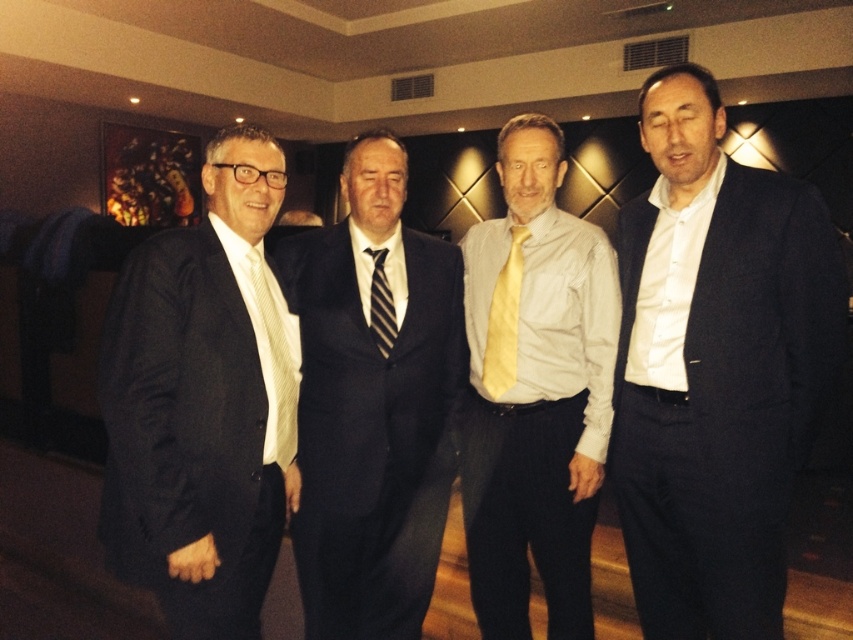
Between point (206, 461) and point (281, 321), which one is positioned in front?

Point (206, 461) is more forward.

Identify the location of matte black suit at left. (202, 403).

Who is more forward, (x=215, y=413) or (x=279, y=397)?

Point (x=215, y=413)

Where is `matte black suit at left`? matte black suit at left is located at coordinates (202, 403).

Does point (708, 291) come in front of point (502, 464)?

Yes, it is in front of point (502, 464).

Does dark blue suit at right have a lesser width compared to light gray shirt with yellow tie at center?

No, dark blue suit at right is not thinner than light gray shirt with yellow tie at center.

Describe the element at coordinates (715, 369) in the screenshot. I see `dark blue suit at right` at that location.

This screenshot has width=853, height=640. What are the coordinates of `dark blue suit at right` in the screenshot? It's located at (715, 369).

Does dark blue suit at right appear on the left side of yellow satin tie at center?

Incorrect, dark blue suit at right is not on the left side of yellow satin tie at center.

Measure the distance between point (x=662, y=381) and camera.

Point (x=662, y=381) and camera are 5.80 feet apart.

Identify the location of dark blue suit at right. (715, 369).